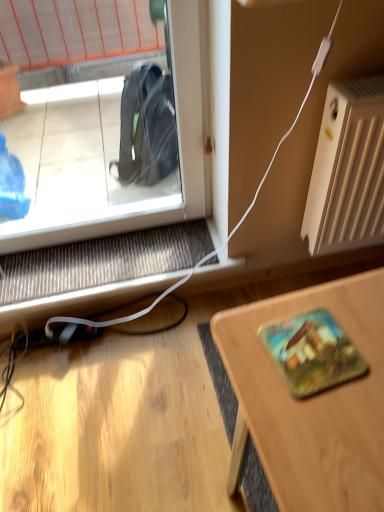
Question: In terms of width, does white matte radiator at right look wider or thinner when compared to wooden desk at lower right?

Choices:
 (A) thin
 (B) wide

Answer: (A)

Question: From the image's perspective, is white matte radiator at right positioned above or below wooden desk at lower right?

Choices:
 (A) above
 (B) below

Answer: (A)

Question: Is white matte radiator at right inside or outside of wooden desk at lower right?

Choices:
 (A) inside
 (B) outside

Answer: (B)

Question: From a real-world perspective, is wooden desk at lower right positioned above or below white matte radiator at right?

Choices:
 (A) above
 (B) below

Answer: (B)

Question: In the image, is wooden desk at lower right positioned in front of or behind white matte radiator at right?

Choices:
 (A) front
 (B) behind

Answer: (A)

Question: Is point (357, 486) closer or farther from the camera than point (329, 202)?

Choices:
 (A) closer
 (B) farther

Answer: (A)

Question: Visually, is wooden desk at lower right positioned to the left or to the right of white matte radiator at right?

Choices:
 (A) right
 (B) left

Answer: (B)